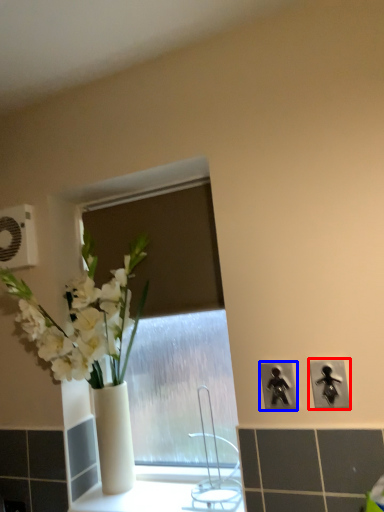
Question: Which point is further to the camera, electric outlet (highlighted by a red box) or electric outlet (highlighted by a blue box)?

Choices:
 (A) electric outlet
 (B) electric outlet

Answer: (B)